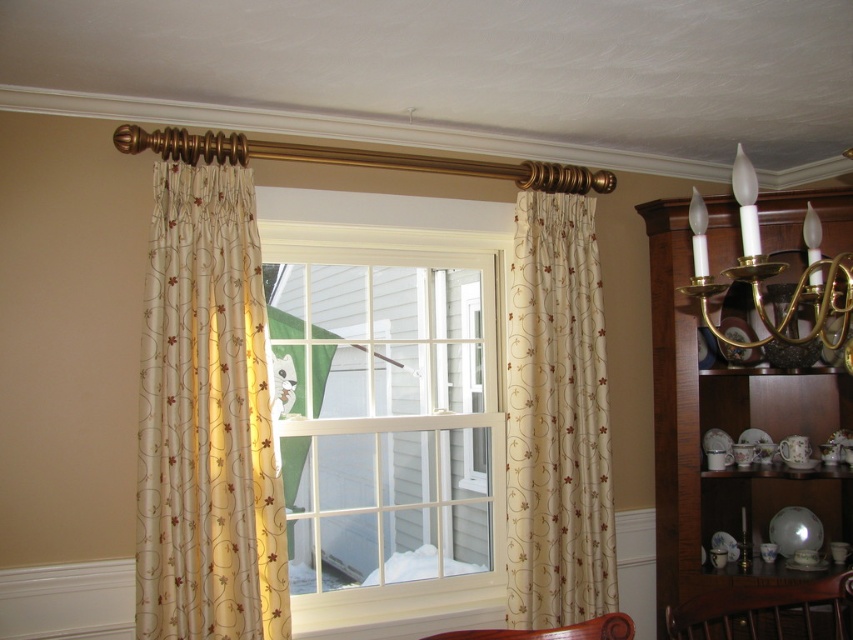
You are standing in the room and want to reach the beige floral fabric curtain at right. Based on its 2D location coordinates, which direction should you move from your current position to approach it?

The beige floral fabric curtain at right is located at coordinates point (556, 419), so you should move towards the right side of the room to approach it.

You are an interior designer planning to install a new decorative item between the white glass window at center and the beige floral fabric curtain at right. Based on their widths, which object should you place closer to the center of the room to maintain symmetry?

The white glass window at center might be wider than beige floral fabric curtain at right, so placing the window closer to the center would help maintain symmetry as wider elements are often centered for balance.